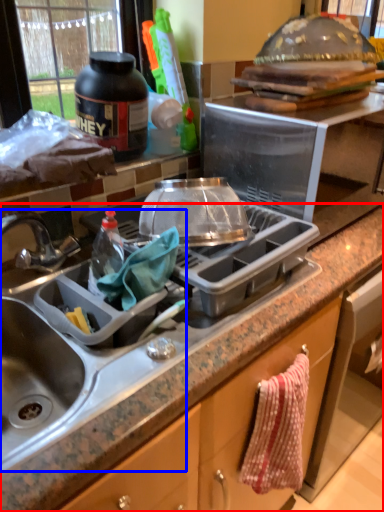
Question: Which object is closer to the camera taking this photo, countertop (highlighted by a red box) or sink (highlighted by a blue box)?

Choices:
 (A) countertop
 (B) sink

Answer: (A)